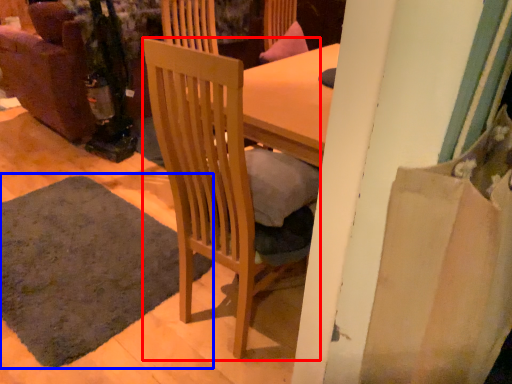
Question: Among these objects, which one is nearest to the camera, chair (highlighted by a red box) or mat (highlighted by a blue box)?

Choices:
 (A) chair
 (B) mat

Answer: (A)